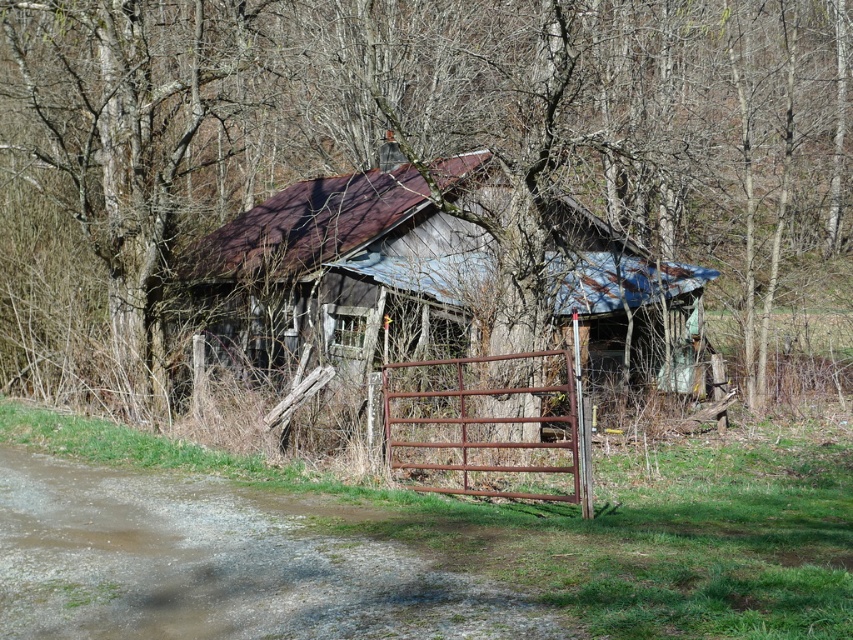
Question: Which of the following is the farthest from the observer?

Choices:
 (A) (715, 99)
 (B) (293, 212)
 (C) (462, 385)

Answer: (A)

Question: Which point is closer to the camera?

Choices:
 (A) rusty metal hut at center
 (B) rusty metal gate at center

Answer: (B)

Question: Can you confirm if brown wood tree at center is positioned to the left of rusty metal gate at center?

Choices:
 (A) yes
 (B) no

Answer: (A)

Question: Can you confirm if rusty metal hut at center is smaller than rusty metal gate at center?

Choices:
 (A) no
 (B) yes

Answer: (A)

Question: Is brown wood tree at center thinner than rusty metal hut at center?

Choices:
 (A) no
 (B) yes

Answer: (A)

Question: Which of the following is the closest to the observer?

Choices:
 (A) rusty metal gate at center
 (B) rusty metal hut at center
 (C) brown wood tree at center

Answer: (A)